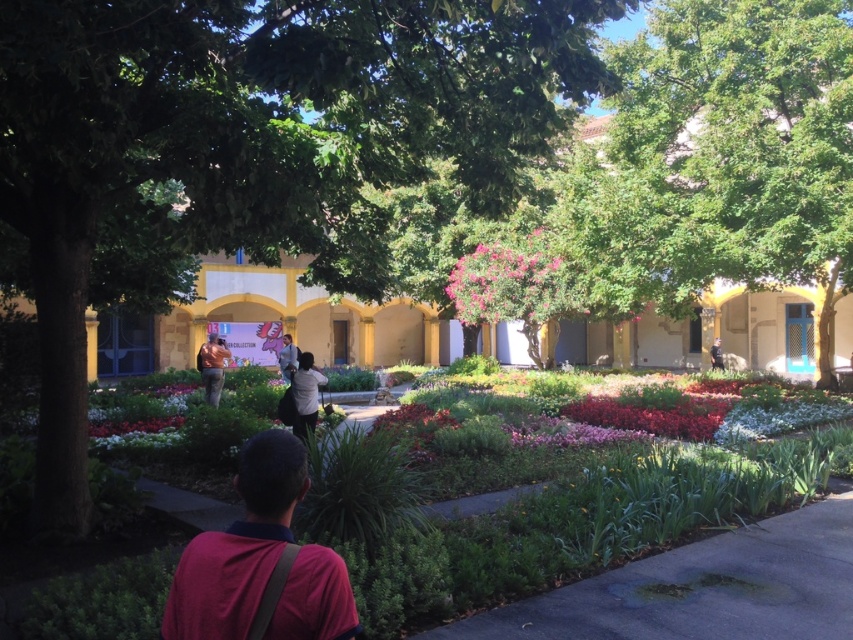
Question: Does dark red shirt at lower left appear on the right side of light gray shirt at center?

Choices:
 (A) yes
 (B) no

Answer: (A)

Question: Can you confirm if dark red shirt at lower left is bigger than brown leather jacket at center?

Choices:
 (A) yes
 (B) no

Answer: (B)

Question: Estimate the real-world distances between objects in this image. Which object is farther from the brown leather jacket at center?

Choices:
 (A) green leafy tree at center
 (B) green asphalt path at center

Answer: (B)

Question: Which point appears farthest from the camera in this image?

Choices:
 (A) (701, 492)
 (B) (427, 56)
 (C) (836, 522)
 (D) (294, 365)

Answer: (D)

Question: Which point appears closest to the camera in this image?

Choices:
 (A) (283, 611)
 (B) (558, 572)
 (C) (836, 138)

Answer: (A)

Question: Does green leafy plants at center appear on the right side of green asphalt path at center?

Choices:
 (A) no
 (B) yes

Answer: (B)